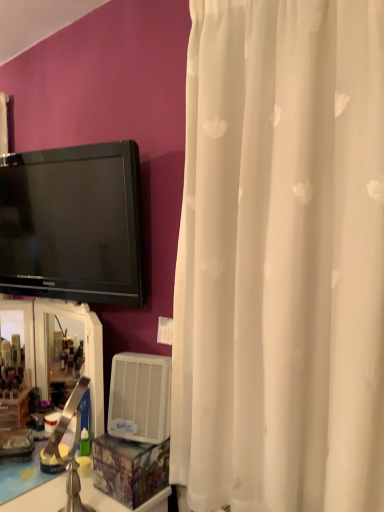
Question: Is white glossy counter top at lower left facing towards white sheer curtain at right?

Choices:
 (A) yes
 (B) no

Answer: (B)

Question: Is white glossy counter top at lower left wider than white sheer curtain at right?

Choices:
 (A) no
 (B) yes

Answer: (B)

Question: Considering the relative sizes of white glossy counter top at lower left and white sheer curtain at right in the image provided, is white glossy counter top at lower left thinner than white sheer curtain at right?

Choices:
 (A) yes
 (B) no

Answer: (B)

Question: Is white glossy counter top at lower left to the right of white sheer curtain at right from the viewer's perspective?

Choices:
 (A) no
 (B) yes

Answer: (A)

Question: Considering the relative sizes of white glossy counter top at lower left and white sheer curtain at right in the image provided, is white glossy counter top at lower left bigger than white sheer curtain at right?

Choices:
 (A) yes
 (B) no

Answer: (A)

Question: Is white glossy counter top at lower left further to the viewer compared to white sheer curtain at right?

Choices:
 (A) yes
 (B) no

Answer: (A)

Question: Considering the relative sizes of translucent plastic mirror at lower left and black glossy tv at upper left in the image provided, is translucent plastic mirror at lower left thinner than black glossy tv at upper left?

Choices:
 (A) yes
 (B) no

Answer: (B)

Question: From a real-world perspective, is translucent plastic mirror at lower left physically below black glossy tv at upper left?

Choices:
 (A) no
 (B) yes

Answer: (B)

Question: Is translucent plastic mirror at lower left at the left side of black glossy tv at upper left?

Choices:
 (A) no
 (B) yes

Answer: (B)

Question: Considering the relative sizes of translucent plastic mirror at lower left and black glossy tv at upper left in the image provided, is translucent plastic mirror at lower left taller than black glossy tv at upper left?

Choices:
 (A) no
 (B) yes

Answer: (A)

Question: From the image's perspective, is translucent plastic mirror at lower left located above black glossy tv at upper left?

Choices:
 (A) no
 (B) yes

Answer: (A)

Question: Is black glossy tv at upper left surrounded by translucent plastic mirror at lower left?

Choices:
 (A) yes
 (B) no

Answer: (B)

Question: Is the position of white plastic air conditioner at lower center more distant than that of translucent plastic mirror at lower left?

Choices:
 (A) no
 (B) yes

Answer: (A)